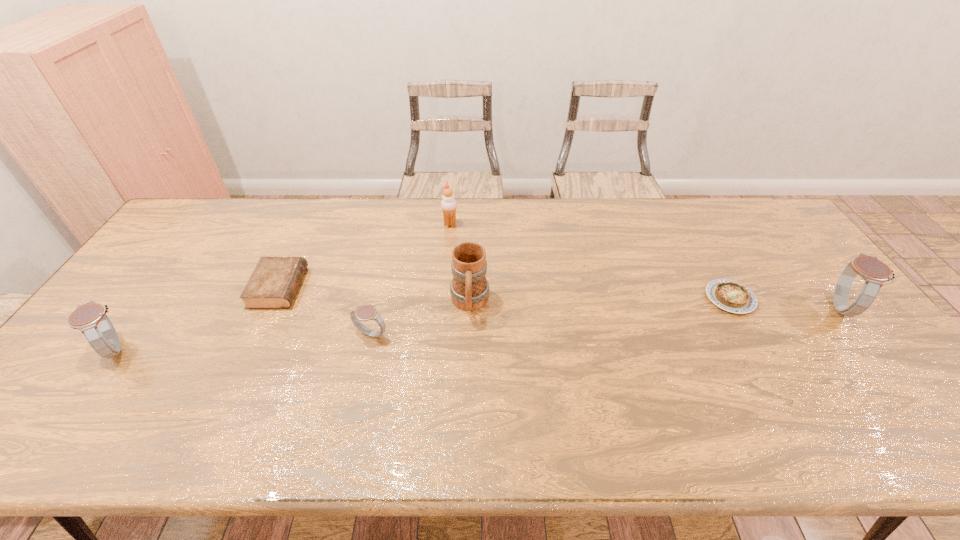
Please point a space for a new watch to maintain equal intervals. Please provide its 2D coordinates. Your answer should be formatted as a tuple, i.e. [(x, y)], where the tuple contains the x and y coordinates of a point satisfying the conditions above.

[(612, 320)]